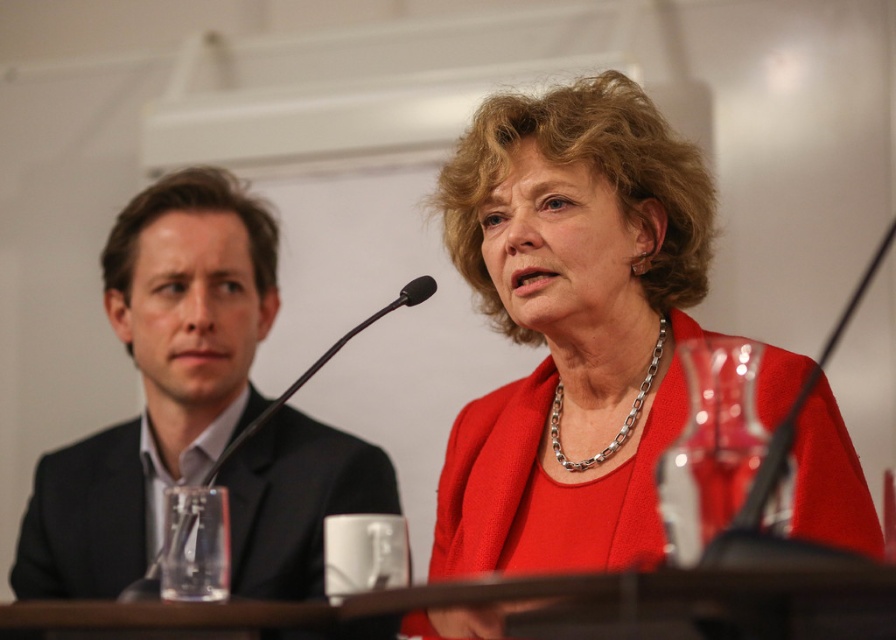
Question: Is matte black suit at left wider than silver chain necklace at center?

Choices:
 (A) no
 (B) yes

Answer: (B)

Question: Which of the following is the farthest from the observer?

Choices:
 (A) matte red blazer at center
 (B) matte black suit at left

Answer: (B)

Question: From the image, what is the correct spatial relationship of matte black suit at left in relation to silver chain necklace at center?

Choices:
 (A) right
 (B) left

Answer: (B)

Question: Which object is the farthest from the matte black suit at left?

Choices:
 (A) silver chain necklace at center
 (B) matte red blazer at center

Answer: (A)

Question: In this image, where is matte red blazer at center located relative to silver chain necklace at center?

Choices:
 (A) left
 (B) right

Answer: (A)

Question: Which is nearer to the matte red blazer at center?

Choices:
 (A) silver chain necklace at center
 (B) matte black suit at left

Answer: (A)